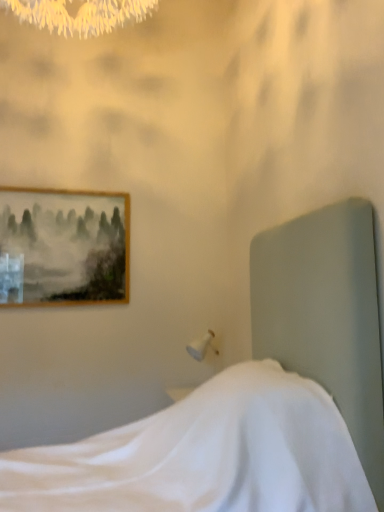
You are a GUI agent. You are given a task and a screenshot of the screen. Output one action in this format:
    pyautogui.click(x=<x>, y=<y>)
    Task: Click on the blank space above wooden framed painting at upper left (from a real-world perspective)
    
    Given the screenshot: What is the action you would take?
    pyautogui.click(x=70, y=188)